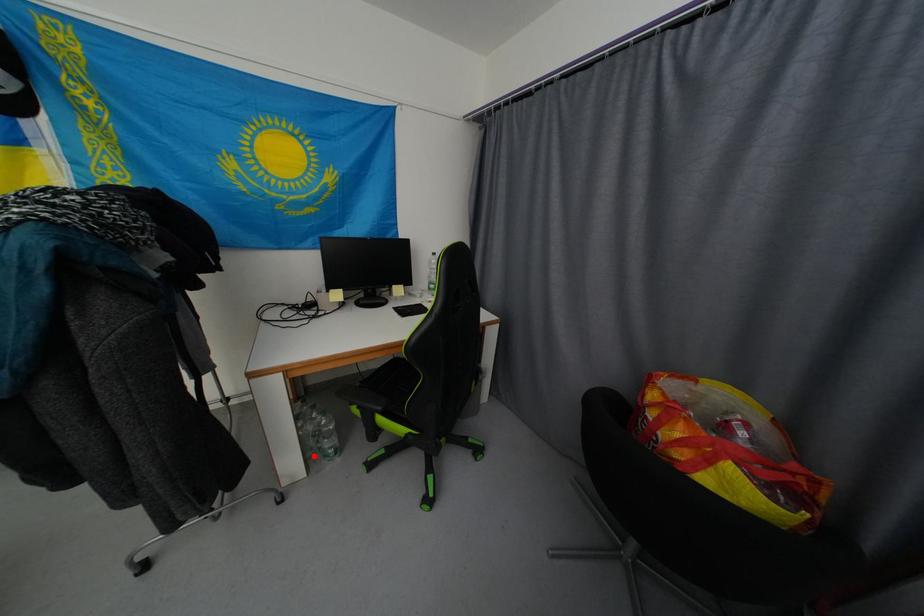
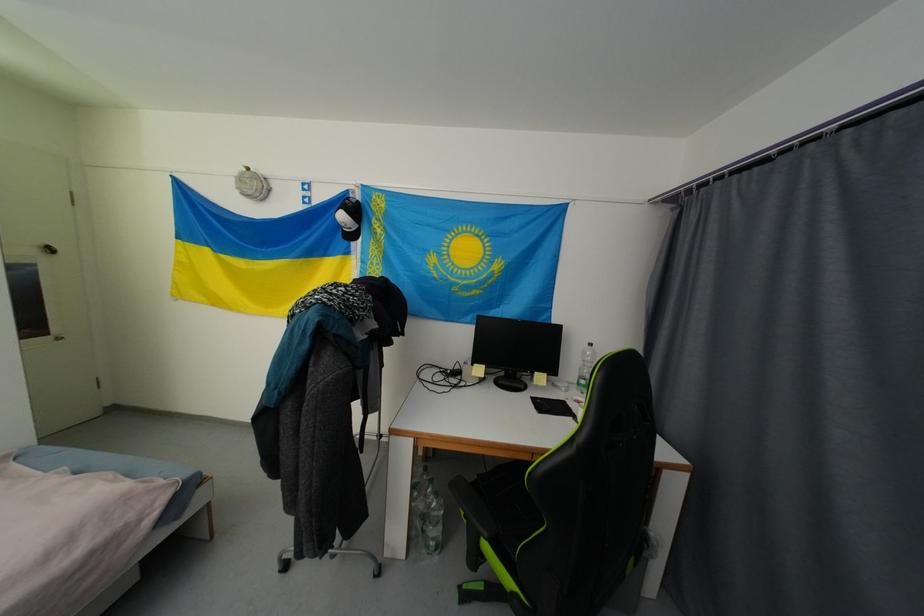
Where in the second image is the point corresponding to the highlighted location from the first image?

(419, 535)